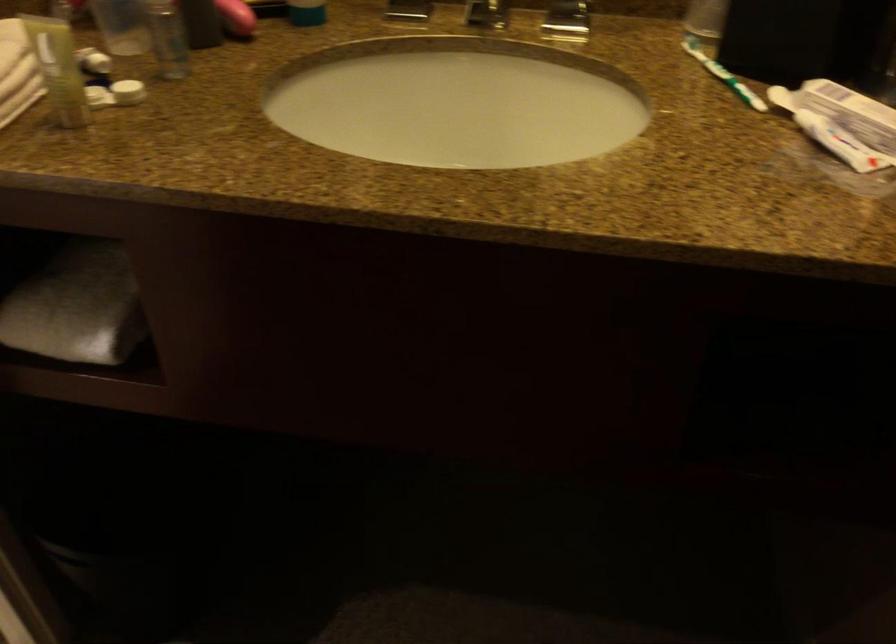
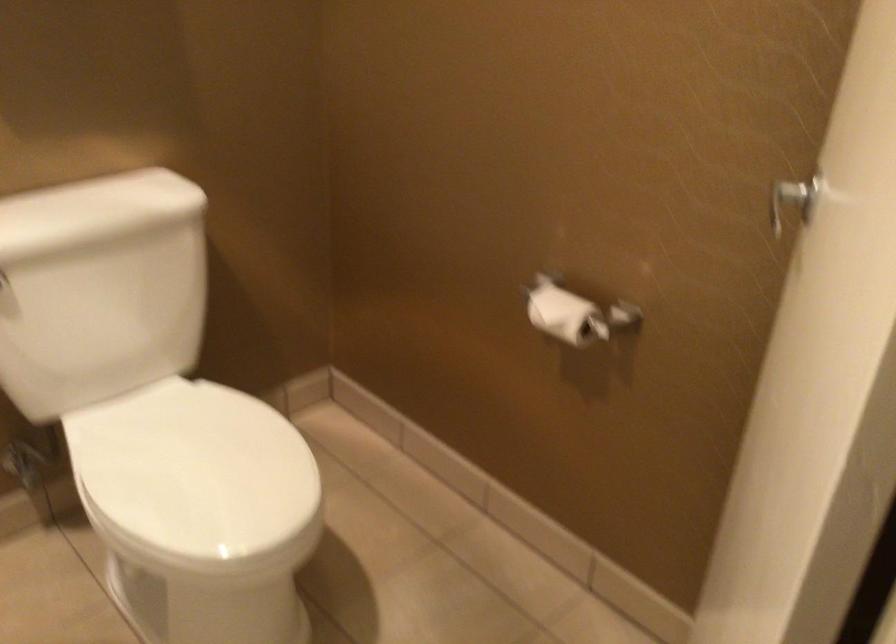
Question: Based on the continuous images, in which direction is the camera rotating? Reply with the corresponding letter.

Choices:
 (A) Left
 (B) Right
 (C) Up
 (D) Down

Answer: (A)